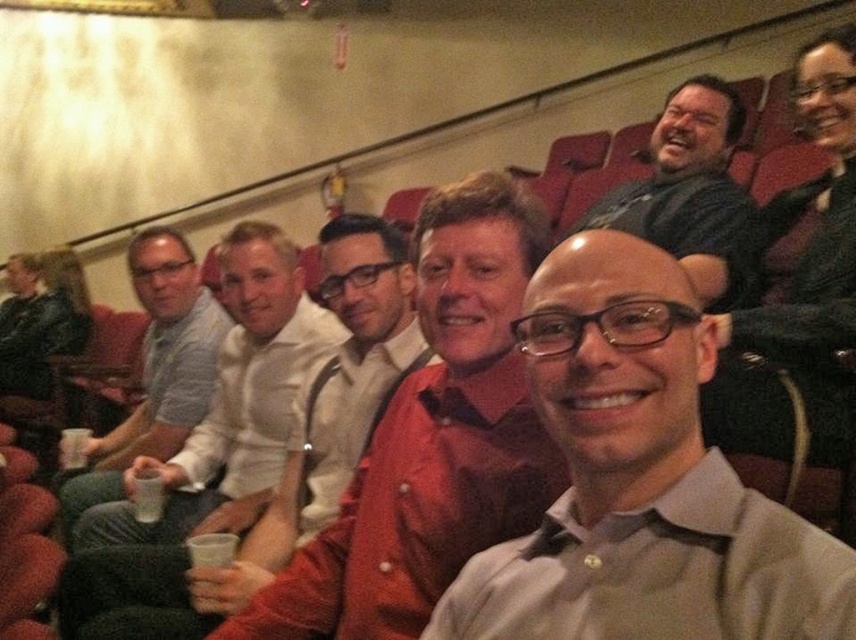
Can you confirm if smooth white shirt at center is positioned to the right of matte black shirt at upper center?

Incorrect, smooth white shirt at center is not on the right side of matte black shirt at upper center.

Who is more distant from viewer, [415,516] or [729,216]?

Point [729,216]

Find the location of a particular element. This screenshot has height=640, width=856. smooth white shirt at center is located at coordinates (432, 440).

Can you confirm if white shirt at center is smaller than white matte cup at lower left?

No.

Does point (268, 520) come in front of point (146, 476)?

Yes, point (268, 520) is in front of point (146, 476).

Where is `white shirt at center`? white shirt at center is located at coordinates (342, 381).

Does smooth white shirt at center appear under white matte cup at lower left?

No, smooth white shirt at center is not below white matte cup at lower left.

Which is below, smooth white shirt at center or white matte cup at lower left?

Positioned lower is white matte cup at lower left.

Between point (423, 246) and point (146, 513), which one is positioned behind?

Point (146, 513)

At what (x,y) coordinates should I click in order to perform the action: click on smooth white shirt at center. Please return your answer as a coordinate pair (x, y). This screenshot has height=640, width=856. Looking at the image, I should click on (432, 440).